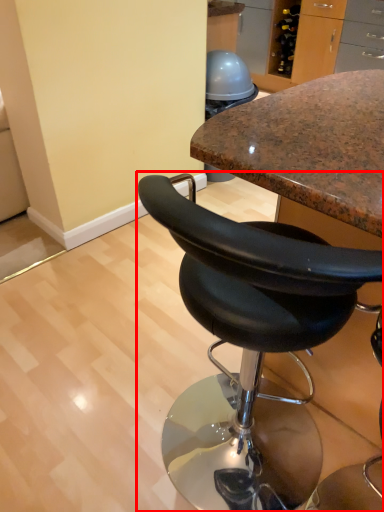
Question: From the image, what is the correct spatial relationship of chair (annotated by the red box) in relation to chair?

Choices:
 (A) left
 (B) right

Answer: (B)